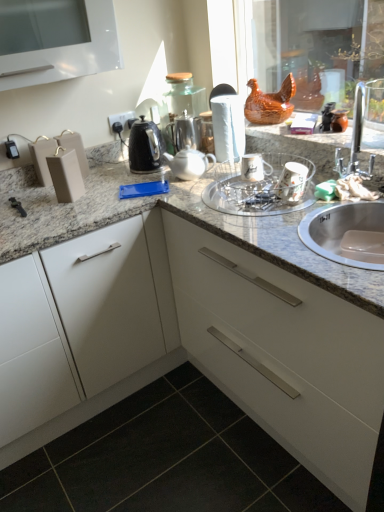
Where is `blank space situated above black tile at lower left (from a real-world perspective)`? This screenshot has width=384, height=512. blank space situated above black tile at lower left (from a real-world perspective) is located at coordinates click(x=163, y=454).